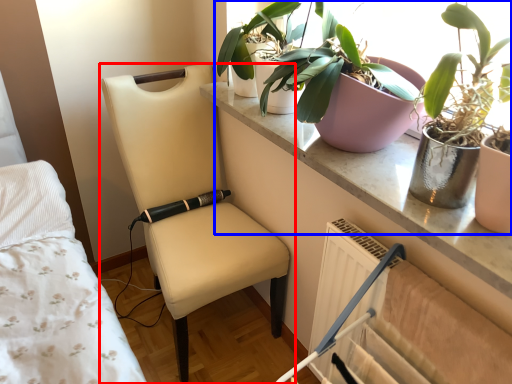
Question: Which object appears closest to the camera in this image, chair (highlighted by a red box) or houseplant (highlighted by a blue box)?

Choices:
 (A) chair
 (B) houseplant

Answer: (B)